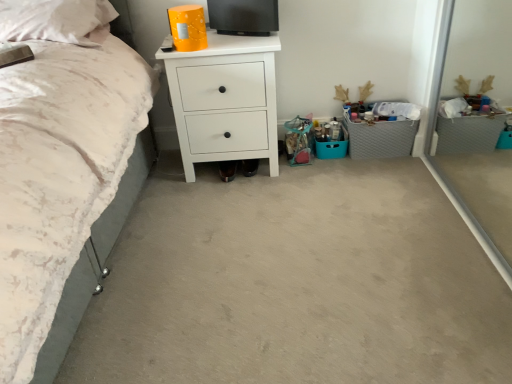
Question: Would you say gray fabric storage at right contains white matte chest of drawers at center?

Choices:
 (A) yes
 (B) no

Answer: (B)

Question: Is gray fabric storage at right shorter than white matte chest of drawers at center?

Choices:
 (A) no
 (B) yes

Answer: (B)

Question: Is gray fabric storage at right facing towards white matte chest of drawers at center?

Choices:
 (A) no
 (B) yes

Answer: (A)

Question: Is gray fabric storage at right located outside white matte chest of drawers at center?

Choices:
 (A) yes
 (B) no

Answer: (A)

Question: Is there a large distance between gray fabric storage at right and white matte chest of drawers at center?

Choices:
 (A) no
 (B) yes

Answer: (A)

Question: Would you say gray fabric storage at right is inside or outside white soft pillow at upper left?

Choices:
 (A) inside
 (B) outside

Answer: (B)

Question: In the image, is gray fabric storage at right on the left side or the right side of white soft pillow at upper left?

Choices:
 (A) right
 (B) left

Answer: (A)

Question: Is point (406, 127) closer or farther from the camera than point (36, 4)?

Choices:
 (A) farther
 (B) closer

Answer: (A)

Question: Is gray fabric storage at right taller or shorter than white soft pillow at upper left?

Choices:
 (A) short
 (B) tall

Answer: (B)

Question: Is gray fabric storage at right inside or outside of white matte chest of drawers at center?

Choices:
 (A) outside
 (B) inside

Answer: (A)

Question: Does point (373, 157) appear closer or farther from the camera than point (230, 36)?

Choices:
 (A) farther
 (B) closer

Answer: (A)

Question: Is gray fabric storage at right bigger or smaller than white matte chest of drawers at center?

Choices:
 (A) big
 (B) small

Answer: (B)

Question: In the image, is gray fabric storage at right positioned in front of or behind white matte chest of drawers at center?

Choices:
 (A) front
 (B) behind

Answer: (B)

Question: Is white soft pillow at upper left wider or thinner than gray fabric storage at right?

Choices:
 (A) thin
 (B) wide

Answer: (B)

Question: Is white soft pillow at upper left taller or shorter than gray fabric storage at right?

Choices:
 (A) short
 (B) tall

Answer: (A)